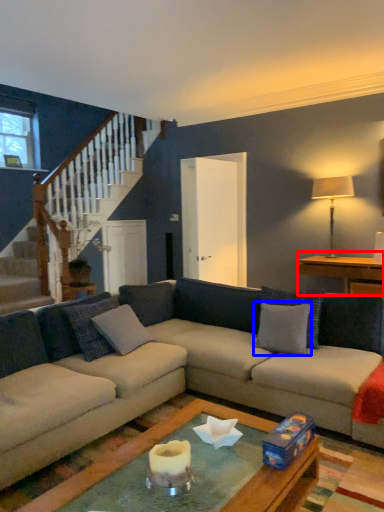
Question: Which point is closer to the camera, table (highlighted by a red box) or pillow (highlighted by a blue box)?

Choices:
 (A) table
 (B) pillow

Answer: (B)